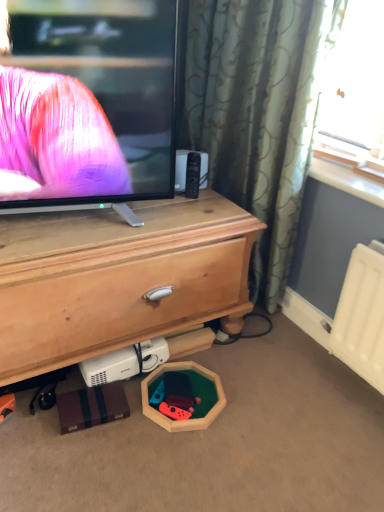
Question: Is wooden hexagon at lower center, which ranks as the second toy in left-to-right order, positioned with its back to wooden hexagon at lower center, the 1th toy viewed from the left?

Choices:
 (A) yes
 (B) no

Answer: (A)

Question: Is wooden hexagon at lower center, which ranks as the second toy in left-to-right order, taller than wooden hexagon at lower center, the 1th toy viewed from the left?

Choices:
 (A) yes
 (B) no

Answer: (B)

Question: From the image's perspective, is wooden hexagon at lower center, which ranks as the second toy in left-to-right order, above wooden hexagon at lower center, the second toy when ordered from right to left?

Choices:
 (A) yes
 (B) no

Answer: (B)

Question: Could wooden hexagon at lower center, the 1th toy viewed from the left, be considered to be inside wooden hexagon at lower center, acting as the 1th toy starting from the right?

Choices:
 (A) no
 (B) yes

Answer: (B)

Question: Is wooden hexagon at lower center, acting as the 1th toy starting from the right, touching wooden hexagon at lower center, the 1th toy viewed from the left?

Choices:
 (A) yes
 (B) no

Answer: (A)

Question: Could you tell me if wooden hexagon at lower center, which ranks as the second toy in left-to-right order, is turned towards wooden hexagon at lower center, the 1th toy viewed from the left?

Choices:
 (A) no
 (B) yes

Answer: (B)

Question: Is wooden chest of drawers at center further to the viewer compared to wooden hexagon at lower center, which ranks as the second toy in left-to-right order?

Choices:
 (A) yes
 (B) no

Answer: (B)

Question: Considering the relative sizes of wooden chest of drawers at center and wooden hexagon at lower center, which ranks as the second toy in left-to-right order, in the image provided, is wooden chest of drawers at center thinner than wooden hexagon at lower center, which ranks as the second toy in left-to-right order,?

Choices:
 (A) no
 (B) yes

Answer: (A)

Question: Is wooden chest of drawers at center shorter than wooden hexagon at lower center, which ranks as the second toy in left-to-right order?

Choices:
 (A) yes
 (B) no

Answer: (B)

Question: From a real-world perspective, is wooden chest of drawers at center on top of wooden hexagon at lower center, which ranks as the second toy in left-to-right order?

Choices:
 (A) no
 (B) yes

Answer: (B)

Question: From the image's perspective, is wooden chest of drawers at center beneath wooden hexagon at lower center, which ranks as the second toy in left-to-right order?

Choices:
 (A) no
 (B) yes

Answer: (A)

Question: Is wooden chest of drawers at center positioned before wooden hexagon at lower center, which ranks as the second toy in left-to-right order?

Choices:
 (A) no
 (B) yes

Answer: (B)

Question: Considering the relative positions of wooden hexagon at lower center, which ranks as the second toy in left-to-right order, and wooden chest of drawers at center in the image provided, is wooden hexagon at lower center, which ranks as the second toy in left-to-right order, behind wooden chest of drawers at center?

Choices:
 (A) yes
 (B) no

Answer: (A)